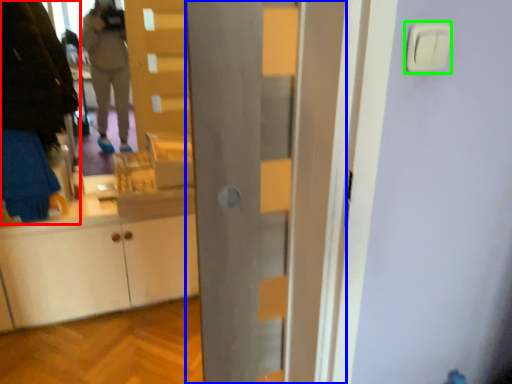
Question: Which object is the closest to the person (highlighted by a red box)? Choose among these: door (highlighted by a blue box) or light switch (highlighted by a green box).

Choices:
 (A) door
 (B) light switch

Answer: (A)